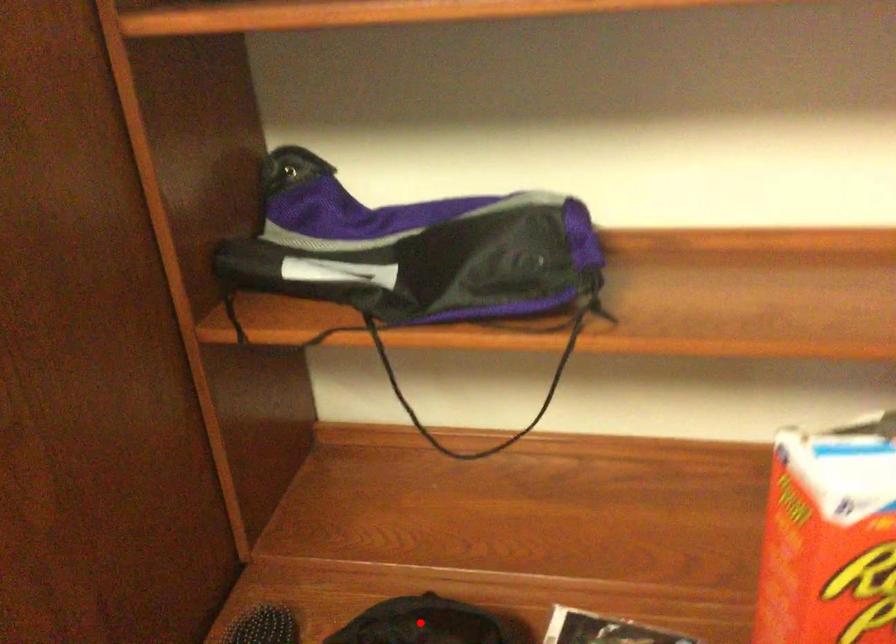
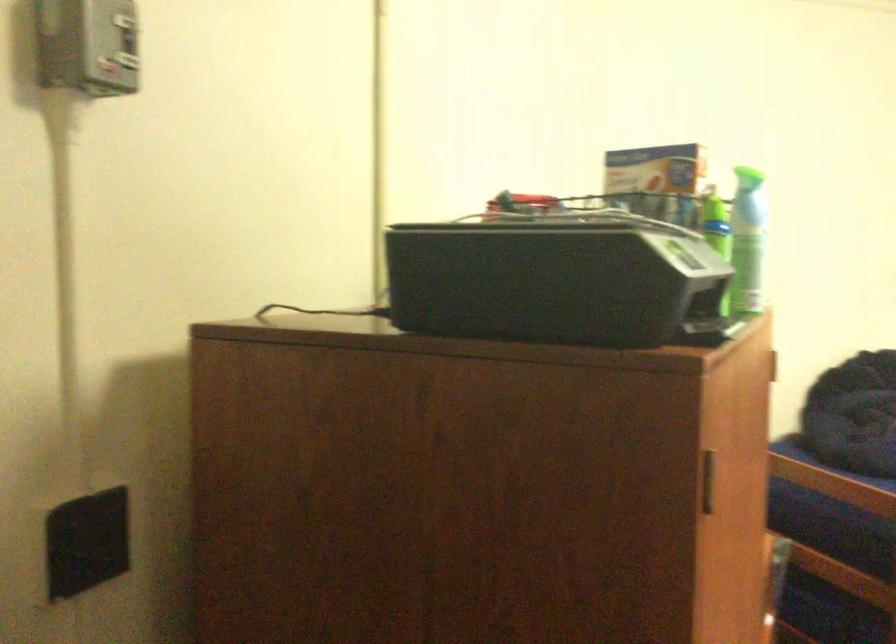
Question: I am providing you with two images of the same scene from different viewpoints. A red point is marked on the first image. At the location where the point appears in image 1, is it still visible in image 2?

Choices:
 (A) Yes
 (B) No

Answer: (B)